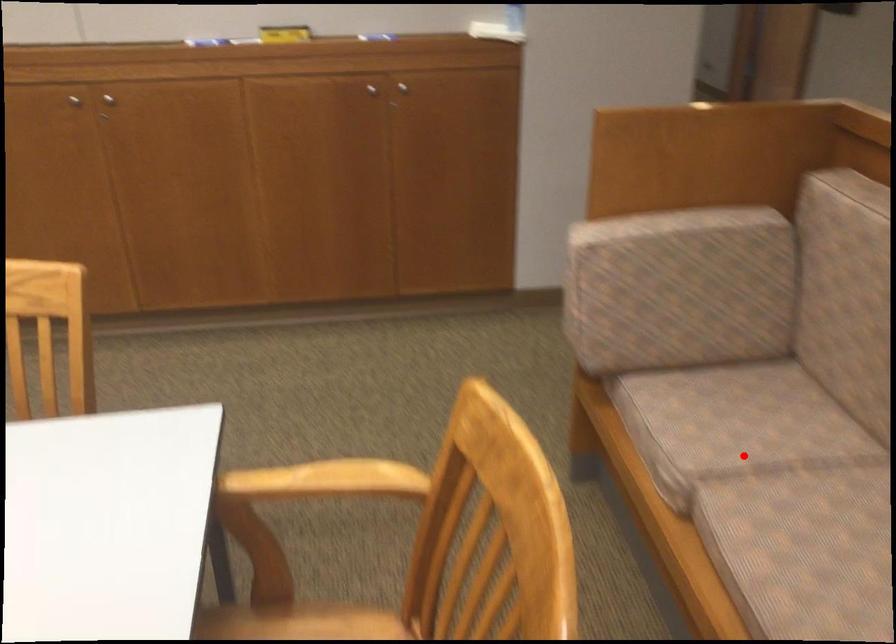
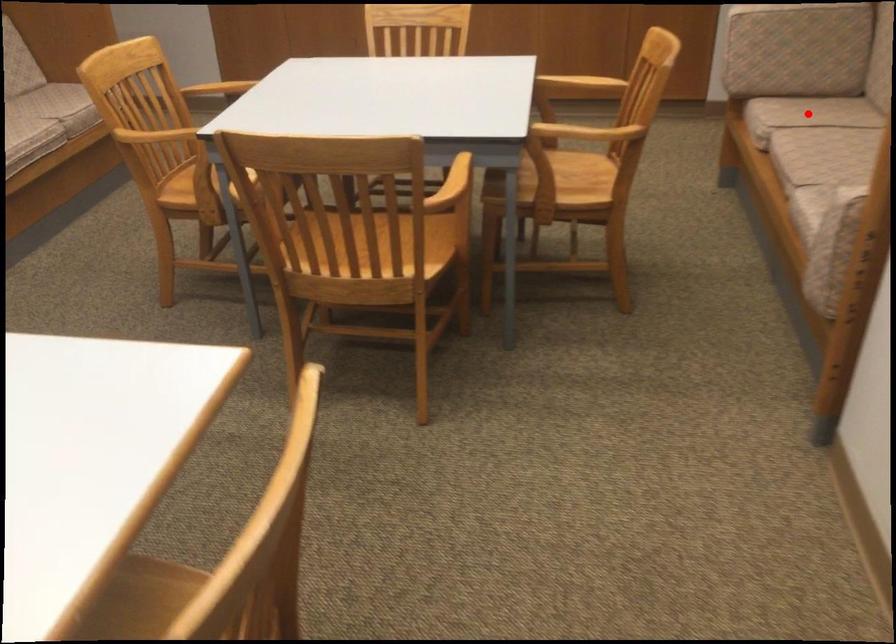
I am providing you with two images of the same scene from different viewpoints. A red point is marked on the first image and another point is marked on the second image. Is the red point in image1 aligned with the point shown in image2?

Yes